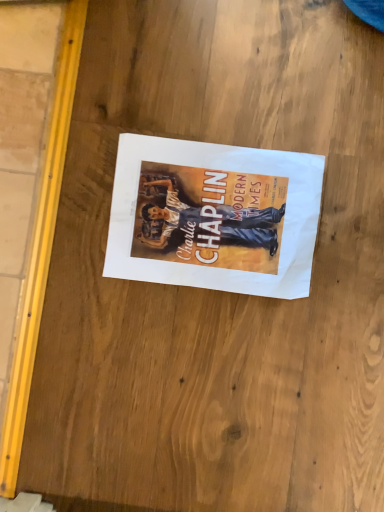
Measure the distance between matte paper poster at center and camera.

matte paper poster at center is 23.40 inches from camera.

The height and width of the screenshot is (512, 384). Describe the element at coordinates (214, 216) in the screenshot. I see `matte paper poster at center` at that location.

I want to click on matte paper poster at center, so click(214, 216).

This screenshot has width=384, height=512. Find the location of `matte paper poster at center`. matte paper poster at center is located at coordinates (214, 216).